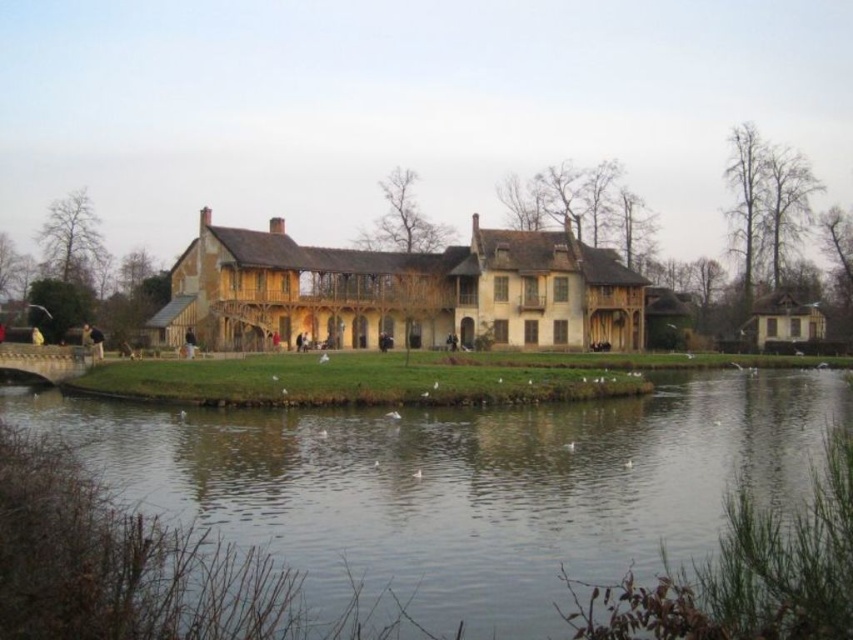
Does wooden mansion at center appear on the left side of wooden thatched-roof cottage at right?

Correct, you'll find wooden mansion at center to the left of wooden thatched-roof cottage at right.

Who is shorter, wooden mansion at center or wooden thatched-roof cottage at right?

wooden thatched-roof cottage at right is shorter.

Find the location of a particular element. Image resolution: width=853 pixels, height=640 pixels. wooden mansion at center is located at coordinates (399, 291).

Is green water at lower center further to camera compared to wooden mansion at center?

That is False.

Between point (753, 444) and point (558, 339), which one is positioned behind?

The point (558, 339) is more distant.

Image resolution: width=853 pixels, height=640 pixels. I want to click on green water at lower center, so click(x=465, y=484).

Who is shorter, green water at lower center or wooden thatched-roof cottage at right?

wooden thatched-roof cottage at right is shorter.

From the picture: Does green water at lower center have a smaller size compared to wooden thatched-roof cottage at right?

No, green water at lower center is not smaller than wooden thatched-roof cottage at right.

What do you see at coordinates (465, 484) in the screenshot? I see `green water at lower center` at bounding box center [465, 484].

Find the location of `green water at lower center`. green water at lower center is located at coordinates (465, 484).